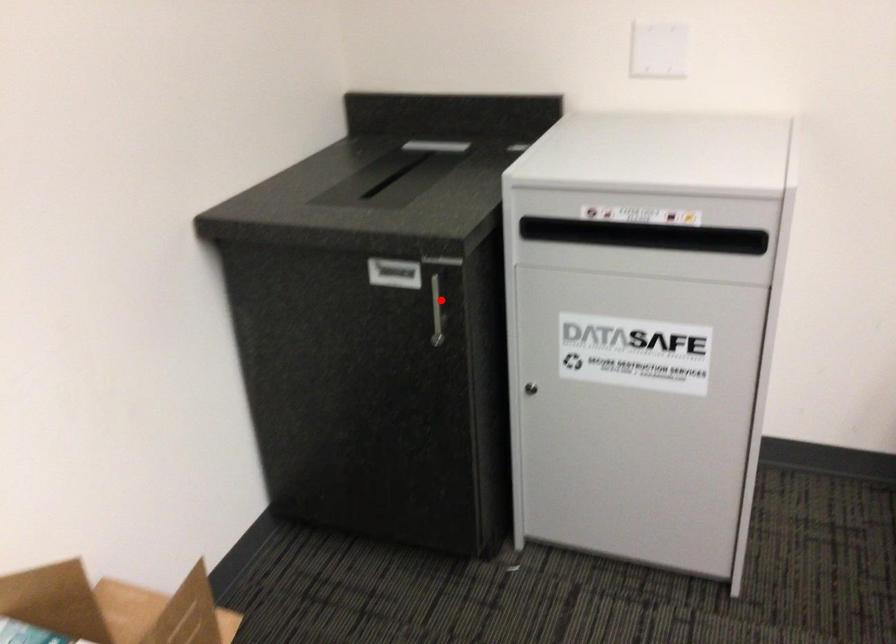
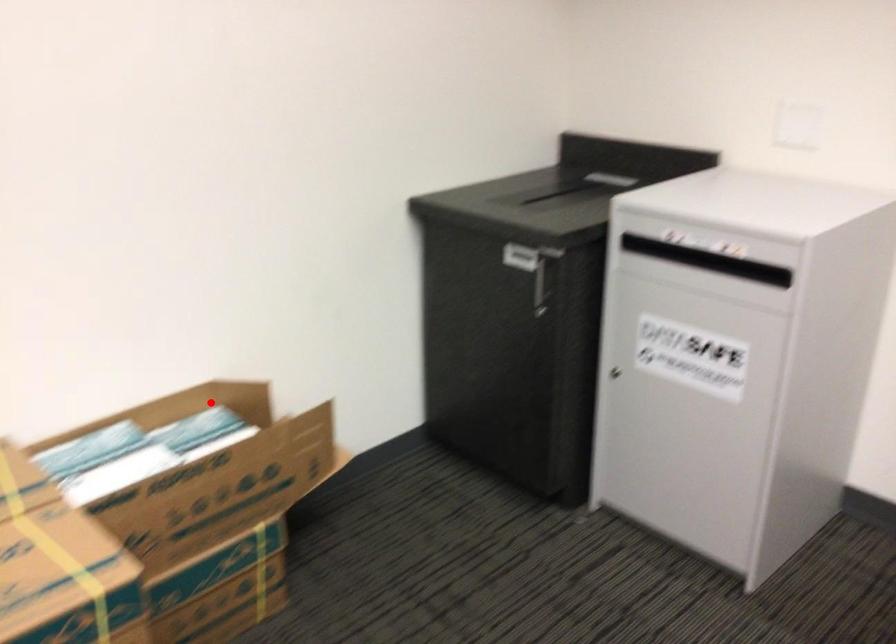
I am providing you with two images of the same scene from different viewpoints. A red point is marked on the first image and another point is marked on the second image. Is the marked point in image1 the same physical position as the marked point in image2?

No